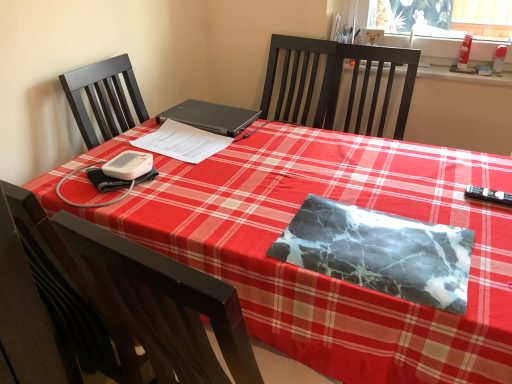
Question: Is black plastic remote control at right positioned in front of black matte laptop at center?

Choices:
 (A) no
 (B) yes

Answer: (B)

Question: Is black plastic remote control at right bigger than black matte laptop at center?

Choices:
 (A) no
 (B) yes

Answer: (A)

Question: From the image's perspective, is black plastic remote control at right above black matte laptop at center?

Choices:
 (A) no
 (B) yes

Answer: (A)

Question: Does black plastic remote control at right turn towards black matte laptop at center?

Choices:
 (A) yes
 (B) no

Answer: (B)

Question: Is black plastic remote control at right further to the viewer compared to black matte laptop at center?

Choices:
 (A) yes
 (B) no

Answer: (B)

Question: Is point (229, 142) positioned closer to the camera than point (232, 127)?

Choices:
 (A) farther
 (B) closer

Answer: (B)

Question: Considering the positions of white paper at center, arranged as the 2th notebook when viewed from the front, and black matte laptop at center in the image, is white paper at center, arranged as the 2th notebook when viewed from the front, bigger or smaller than black matte laptop at center?

Choices:
 (A) big
 (B) small

Answer: (B)

Question: Is white paper at center, marked as the 1th notebook in a back-to-front arrangement, inside the boundaries of black matte laptop at center, or outside?

Choices:
 (A) inside
 (B) outside

Answer: (B)

Question: Considering the relative positions of white paper at center, the second notebook from the bottom, and black matte laptop at center in the image provided, is white paper at center, the second notebook from the bottom, to the left or to the right of black matte laptop at center?

Choices:
 (A) left
 (B) right

Answer: (A)

Question: Is black plastic remote control at right bigger or smaller than black matte laptop at center?

Choices:
 (A) small
 (B) big

Answer: (A)

Question: Is black plastic remote control at right wider or thinner than black matte laptop at center?

Choices:
 (A) thin
 (B) wide

Answer: (A)

Question: Considering their positions, is black plastic remote control at right located in front of or behind black matte laptop at center?

Choices:
 (A) behind
 (B) front

Answer: (B)

Question: From a real-world perspective, is black plastic remote control at right physically located above or below black matte laptop at center?

Choices:
 (A) below
 (B) above

Answer: (A)

Question: Is point (475, 195) closer or farther from the camera than point (200, 142)?

Choices:
 (A) farther
 (B) closer

Answer: (B)

Question: In terms of width, does black plastic remote control at right look wider or thinner when compared to white paper at center, which appears as the 1th notebook when viewed from the top?

Choices:
 (A) wide
 (B) thin

Answer: (B)